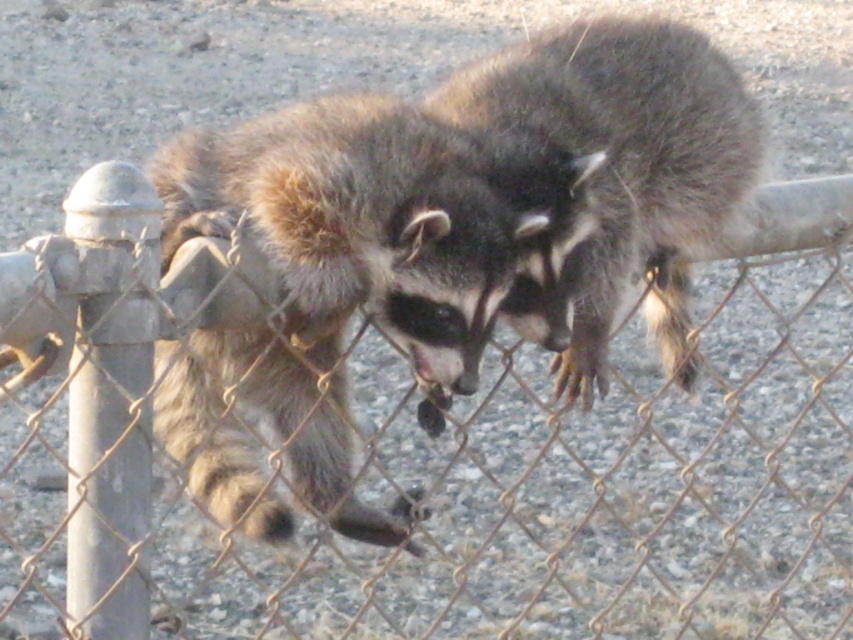
Question: Which object is closer to the camera taking this photo?

Choices:
 (A) dark brown fur raccoon at center
 (B) fuzzy brown raccoon at center

Answer: (B)

Question: Which point appears closest to the camera in this image?

Choices:
 (A) (236, 435)
 (B) (550, 138)

Answer: (B)

Question: Can you confirm if fuzzy brown raccoon at center is thinner than dark brown fur raccoon at center?

Choices:
 (A) no
 (B) yes

Answer: (B)

Question: Does fuzzy brown raccoon at center have a larger size compared to dark brown fur raccoon at center?

Choices:
 (A) yes
 (B) no

Answer: (B)

Question: Can you confirm if fuzzy brown raccoon at center is positioned to the left of dark brown fur raccoon at center?

Choices:
 (A) no
 (B) yes

Answer: (B)